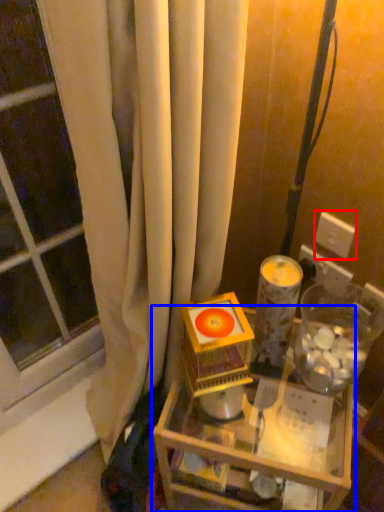
Question: Which of the following is the farthest to the observer, electric outlet (highlighted by a red box) or table (highlighted by a blue box)?

Choices:
 (A) electric outlet
 (B) table

Answer: (A)